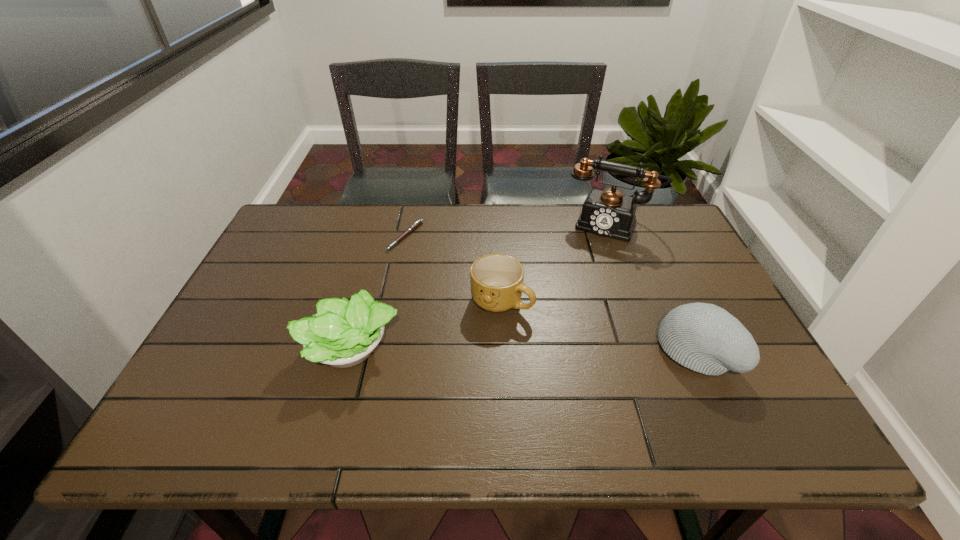
I want to click on lettuce, so [343, 333].

This screenshot has width=960, height=540. Identify the location of beanie. (705, 338).

Identify the location of telephone. The image size is (960, 540). (609, 213).

Where is `the shortest object`? the shortest object is located at coordinates (419, 222).

You are a GUI agent. You are given a task and a screenshot of the screen. Output one action in this format:
    pyautogui.click(x=<x>, y=<y>)
    Task: Click on the mug
    The height and width of the screenshot is (540, 960).
    Given the screenshot: What is the action you would take?
    pyautogui.click(x=497, y=280)

Where is `vacant space situated 0.400m on the right of the lettuce`? The width and height of the screenshot is (960, 540). vacant space situated 0.400m on the right of the lettuce is located at coordinates (569, 349).

At what (x,y) coordinates should I click in order to perform the action: click on vacant space located on the left of the second tallest object. Please return your answer as a coordinate pair (x, y). This screenshot has height=540, width=960. Looking at the image, I should click on (515, 350).

Locate an element on the screen. Image resolution: width=960 pixels, height=540 pixels. free space located 0.260m on the front of the tallest object at the rotary dial is located at coordinates (576, 295).

In order to click on free region located on the front of the tallest object at the rotary dial in this screenshot , I will do `click(583, 276)`.

This screenshot has width=960, height=540. What are the coordinates of `free space located on the front of the tallest object at the rotary dial` in the screenshot? It's located at (565, 320).